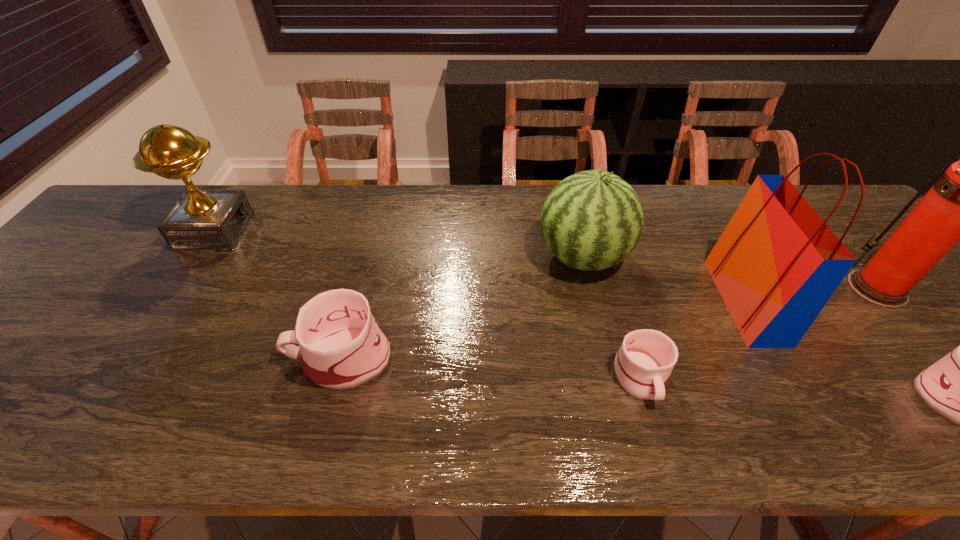
You are a GUI agent. You are given a task and a screenshot of the screen. Output one action in this format:
    pyautogui.click(x=<x>, y=<y>)
    Task: Click on the award at the far edge
    The width and height of the screenshot is (960, 540).
    Given the screenshot: What is the action you would take?
    pyautogui.click(x=201, y=219)

Find the location of a particular element. object situated at the right edge is located at coordinates (959, 206).

In the image, there is a desktop. Where is `vacant space at the far edge`? vacant space at the far edge is located at coordinates (458, 217).

Image resolution: width=960 pixels, height=540 pixels. In the image, there is a desktop. Identify the location of vacant space at the near edge. (461, 376).

Locate an element on the screen. The image size is (960, 540). vacant space at the left edge of the desktop is located at coordinates (80, 286).

Image resolution: width=960 pixels, height=540 pixels. What are the coordinates of `free spot between the fire extinguisher and the leftmost object` in the screenshot? It's located at (546, 260).

This screenshot has width=960, height=540. In order to click on vacant point located between the fire extinguisher and the tallest mug in this screenshot , I will do `click(609, 323)`.

At what (x,y) coordinates should I click in order to perform the action: click on free spot between the watermelon and the leftmost mug. Please return your answer as a coordinate pair (x, y). This screenshot has height=540, width=960. Looking at the image, I should click on (462, 307).

Image resolution: width=960 pixels, height=540 pixels. I want to click on object that stands as the second closest to the award, so click(592, 220).

The height and width of the screenshot is (540, 960). What are the coordinates of `object that is the third closest one to the second mug from right to left` in the screenshot? It's located at (341, 347).